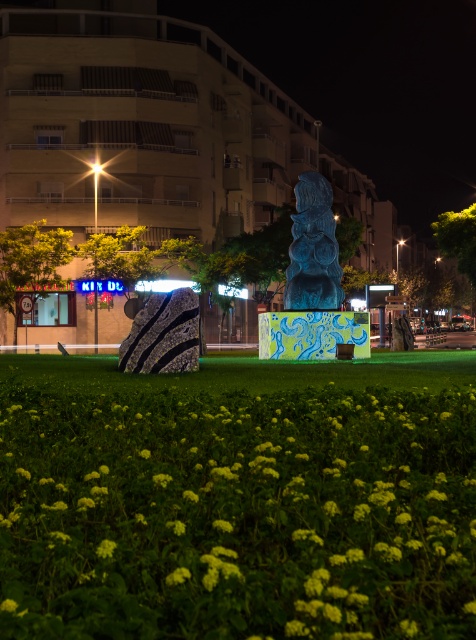
Question: Which object appears farthest from the camera in this image?

Choices:
 (A) blue glossy statue at center
 (B) green matte flower at lower center
 (C) yellow matte flowers at center

Answer: (A)

Question: Which object is closer to the camera taking this photo?

Choices:
 (A) yellow matte flowers at center
 (B) green matte flower at lower center

Answer: (B)

Question: Does yellow matte flowers at center have a smaller size compared to blue glossy statue at center?

Choices:
 (A) yes
 (B) no

Answer: (A)

Question: Can you confirm if yellow matte flowers at center is thinner than green matte flower at lower center?

Choices:
 (A) no
 (B) yes

Answer: (A)

Question: Which object is positioned farthest from the yellow matte flowers at center?

Choices:
 (A) green matte flower at lower center
 (B) blue glossy statue at center

Answer: (B)

Question: Does yellow matte flowers at center appear over green matte flower at lower center?

Choices:
 (A) no
 (B) yes

Answer: (A)